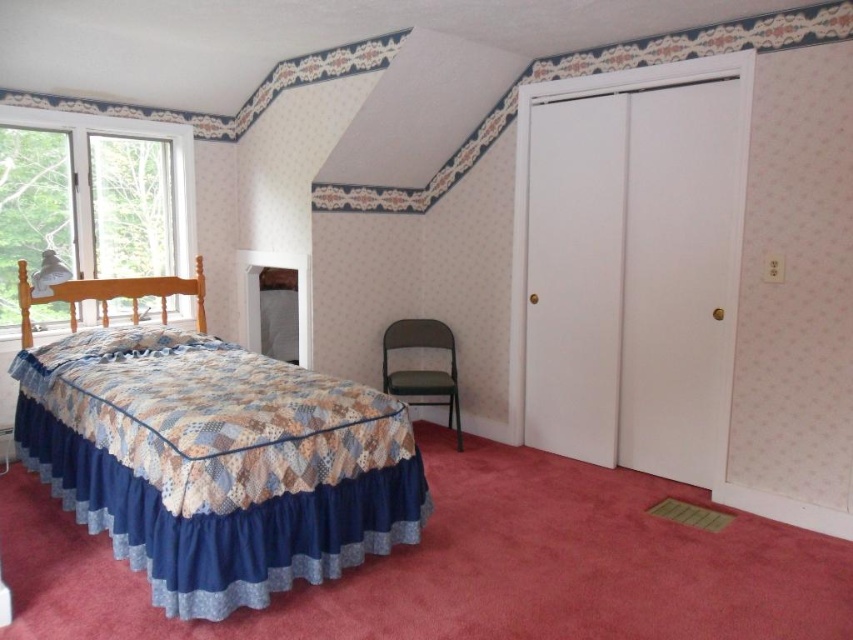
Can you confirm if patchwork fabric bed at left is thinner than matte green folding chair at center?

No.

Is patchwork fabric bed at left closer to the viewer compared to matte green folding chair at center?

Yes, patchwork fabric bed at left is closer to the viewer.

Is point (172, 602) farther from viewer compared to point (434, 380)?

That is False.

The width and height of the screenshot is (853, 640). Find the location of `patchwork fabric bed at left`. patchwork fabric bed at left is located at coordinates (216, 461).

Does clear glass window at left have a smaller size compared to matte green folding chair at center?

Actually, clear glass window at left might be larger than matte green folding chair at center.

Is clear glass window at left thinner than matte green folding chair at center?

No.

Find the location of `clear glass window at left`. clear glass window at left is located at coordinates (122, 193).

Image resolution: width=853 pixels, height=640 pixels. In order to click on patchwork fabric bed at left in this screenshot , I will do `click(216, 461)`.

Is patchwork fabric bed at left behind clear glass window at left?

No, it is in front of clear glass window at left.

Which is behind, point (200, 582) or point (166, 160)?

Positioned behind is point (166, 160).

At what (x,y) coordinates should I click in order to perform the action: click on patchwork fabric bed at left. Please return your answer as a coordinate pair (x, y). Image resolution: width=853 pixels, height=640 pixels. Looking at the image, I should click on click(x=216, y=461).